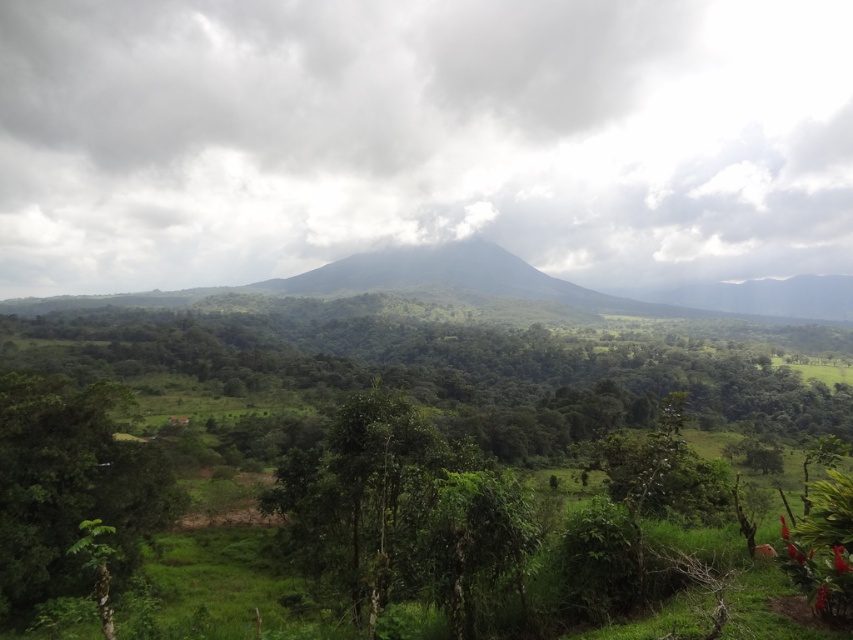
You are standing in the lush, verdant landscape described. You notice a point marked at coordinates (421, 138). What object does this point correspond to?

The point at (421, 138) corresponds to the white fluffy cloud at upper center.

You are standing at the point marked by the coordinates point (431, 371) in the image. What type of object are you directly facing?

The point (431, 371) indicates a green leafy tree at center, so you are directly facing a green leafy tree at center.